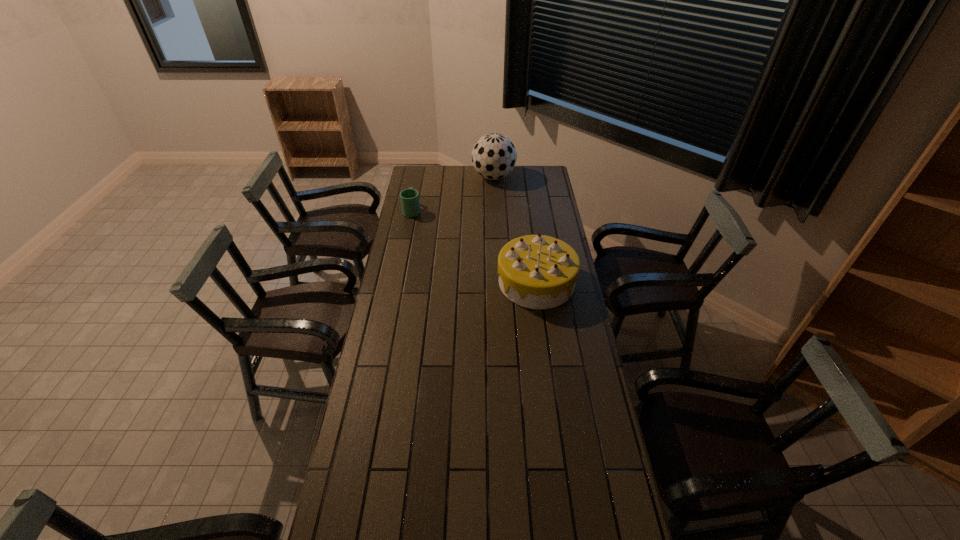
Where is `vacant area that lies between the soccer ball and the second shortest object`? The width and height of the screenshot is (960, 540). vacant area that lies between the soccer ball and the second shortest object is located at coordinates (515, 230).

Find the location of a particular element. This screenshot has width=960, height=540. vacant space that's between the nearest object and the soccer ball is located at coordinates (515, 230).

The width and height of the screenshot is (960, 540). I want to click on empty location between the mug and the soccer ball, so click(x=453, y=194).

Where is `free space between the farthest object and the nearest object`? free space between the farthest object and the nearest object is located at coordinates (515, 230).

Identify the location of blank region between the shortest object and the nearest object. This screenshot has height=540, width=960. (474, 246).

Identify which object is located as the second nearest to the farthest object. Please provide its 2D coordinates. Your answer should be formatted as a tuple, i.e. [(x, y)], where the tuple contains the x and y coordinates of a point satisfying the conditions above.

[(535, 271)]

Image resolution: width=960 pixels, height=540 pixels. I want to click on the closest object to the tallest object, so click(x=409, y=197).

Image resolution: width=960 pixels, height=540 pixels. Find the location of `vacant area in the image that satisfies the following two spatial constraints: 1. on the front side of the tallest object; 2. on the left side of the nearest object`. vacant area in the image that satisfies the following two spatial constraints: 1. on the front side of the tallest object; 2. on the left side of the nearest object is located at coordinates pos(498,282).

Locate an element on the screen. The height and width of the screenshot is (540, 960). free region that satisfies the following two spatial constraints: 1. on the side of the farthest object with the handle; 2. on the right side of the second nearest object is located at coordinates (419, 177).

Where is `vacant position in the image that satisfies the following two spatial constraints: 1. on the front side of the birthday cake; 2. on the right side of the tallest object`? This screenshot has height=540, width=960. vacant position in the image that satisfies the following two spatial constraints: 1. on the front side of the birthday cake; 2. on the right side of the tallest object is located at coordinates (498, 282).